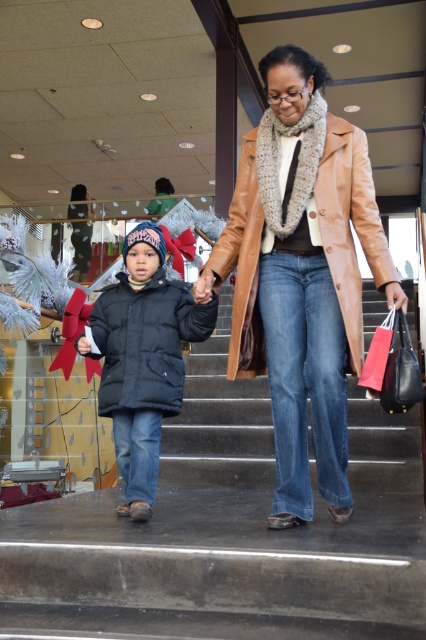
Question: Estimate the real-world distances between objects in this image. Which object is closer to the leather coat at center?

Choices:
 (A) matte black jacket at center
 (B) smooth concrete stairs at center

Answer: (A)

Question: Does smooth concrete stairs at center lie behind matte black jacket at center?

Choices:
 (A) no
 (B) yes

Answer: (A)

Question: Which of these objects is positioned closest to the smooth concrete stairs at center?

Choices:
 (A) matte black jacket at center
 (B) leather coat at center

Answer: (A)

Question: Is leather coat at center to the right of matte black jacket at center from the viewer's perspective?

Choices:
 (A) no
 (B) yes

Answer: (B)

Question: Among these objects, which one is farthest from the camera?

Choices:
 (A) matte black jacket at center
 (B) smooth concrete stairs at center
 (C) leather coat at center

Answer: (A)

Question: From the image, what is the correct spatial relationship of smooth concrete stairs at center in relation to matte black jacket at center?

Choices:
 (A) above
 (B) below

Answer: (B)